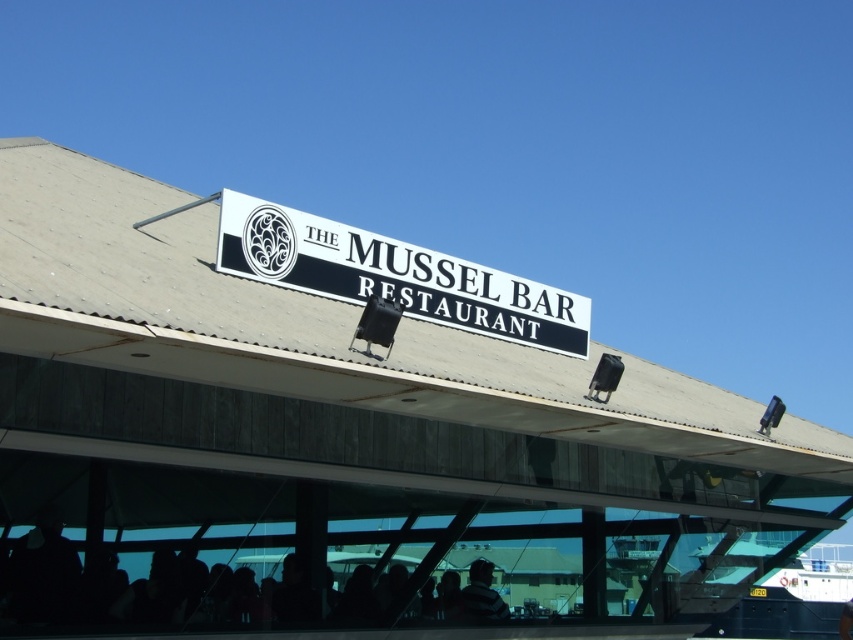
Question: Which of the following is the farthest from the observer?

Choices:
 (A) dark gray sweater at lower center
 (B) silhouette skin at lower center
 (C) white plastic sign at center

Answer: (A)

Question: Can you confirm if white plastic sign at center is positioned to the left of dark gray sweater at lower center?

Choices:
 (A) yes
 (B) no

Answer: (A)

Question: Can you confirm if silhouette skin at lower center is positioned to the left of dark gray sweater at lower center?

Choices:
 (A) no
 (B) yes

Answer: (B)

Question: Which of the following is the farthest from the observer?

Choices:
 (A) (79, 490)
 (B) (479, 564)

Answer: (B)

Question: Is silhouette skin at lower center wider than white plastic sign at center?

Choices:
 (A) no
 (B) yes

Answer: (B)

Question: Which is nearer to the white plastic sign at center?

Choices:
 (A) silhouette skin at lower center
 (B) dark gray sweater at lower center

Answer: (A)